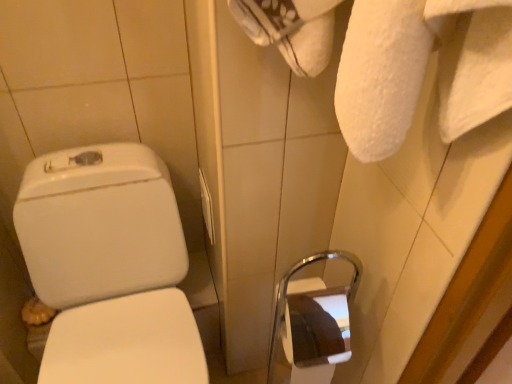
Question: Do you think white glossy toilet at left is within white plastic towel bar at center, or outside of it?

Choices:
 (A) outside
 (B) inside

Answer: (A)

Question: From the image's perspective, is white glossy toilet at left positioned above or below white plastic towel bar at center?

Choices:
 (A) below
 (B) above

Answer: (A)

Question: Considering the positions of white glossy toilet at left and white plastic towel bar at center in the image, is white glossy toilet at left wider or thinner than white plastic towel bar at center?

Choices:
 (A) wide
 (B) thin

Answer: (A)

Question: Is point (203, 218) positioned closer to the camera than point (175, 309)?

Choices:
 (A) closer
 (B) farther

Answer: (B)

Question: Considering the positions of white plastic towel bar at center and white glossy toilet at left in the image, is white plastic towel bar at center taller or shorter than white glossy toilet at left?

Choices:
 (A) short
 (B) tall

Answer: (A)

Question: Considering the positions of white plastic towel bar at center and white glossy toilet at left in the image, is white plastic towel bar at center bigger or smaller than white glossy toilet at left?

Choices:
 (A) big
 (B) small

Answer: (B)

Question: From a real-world perspective, relative to white glossy toilet at left, is white plastic towel bar at center vertically above or below?

Choices:
 (A) below
 (B) above

Answer: (B)